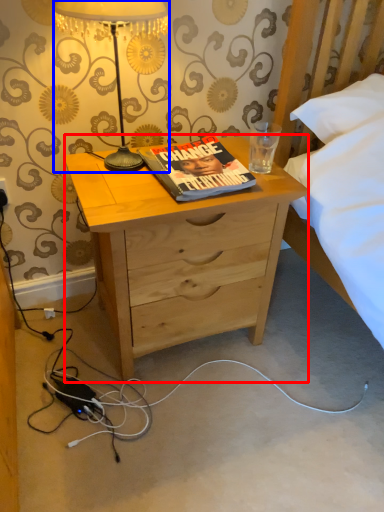
Question: Which of the following is the farthest to the observer, desk (highlighted by a red box) or lamp (highlighted by a blue box)?

Choices:
 (A) desk
 (B) lamp

Answer: (A)